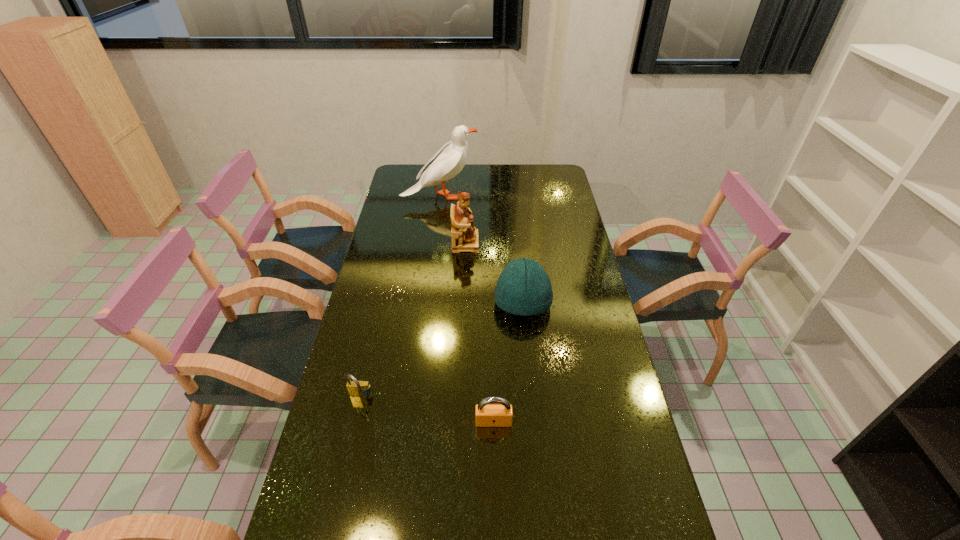
Find the location of a particular element. Image resolution: width=960 pixels, height=540 pixels. vacant area in the image that satisfies the following two spatial constraints: 1. at the beak of the gull; 2. on the side with the combination dials of the fourth farthest object is located at coordinates (416, 397).

Find the location of a particular element. This screenshot has height=540, width=960. vacant region that satisfies the following two spatial constraints: 1. at the beak of the farthest object; 2. on the side with the combination dials of the second nearest object is located at coordinates (416, 397).

You are a GUI agent. You are given a task and a screenshot of the screen. Output one action in this format:
    pyautogui.click(x=<x>, y=<y>)
    Task: Click on the vacant region that satisfies the following two spatial constraints: 1. at the beak of the tallest object; 2. on the left side of the beanie
    Image resolution: width=960 pixels, height=540 pixels.
    Given the screenshot: What is the action you would take?
    pyautogui.click(x=427, y=302)